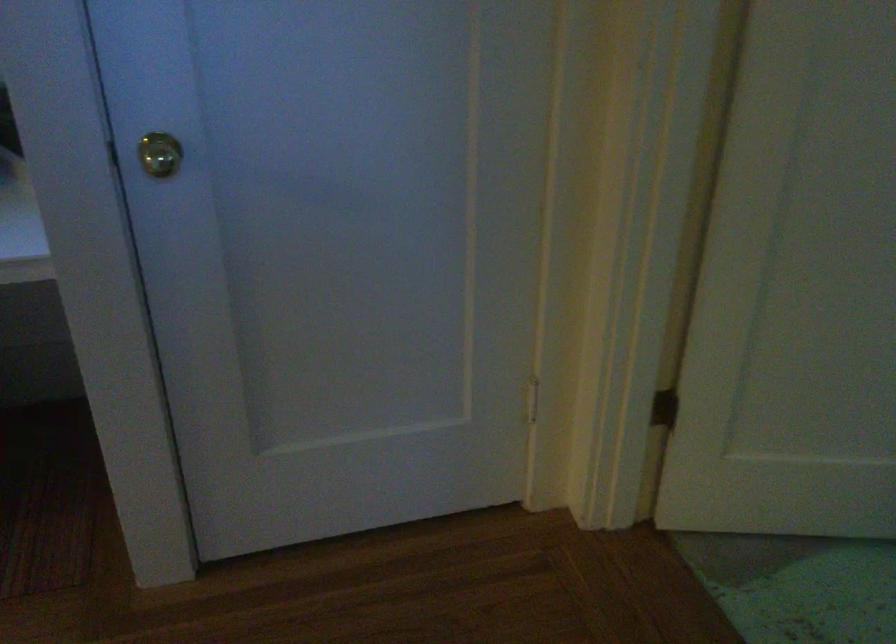
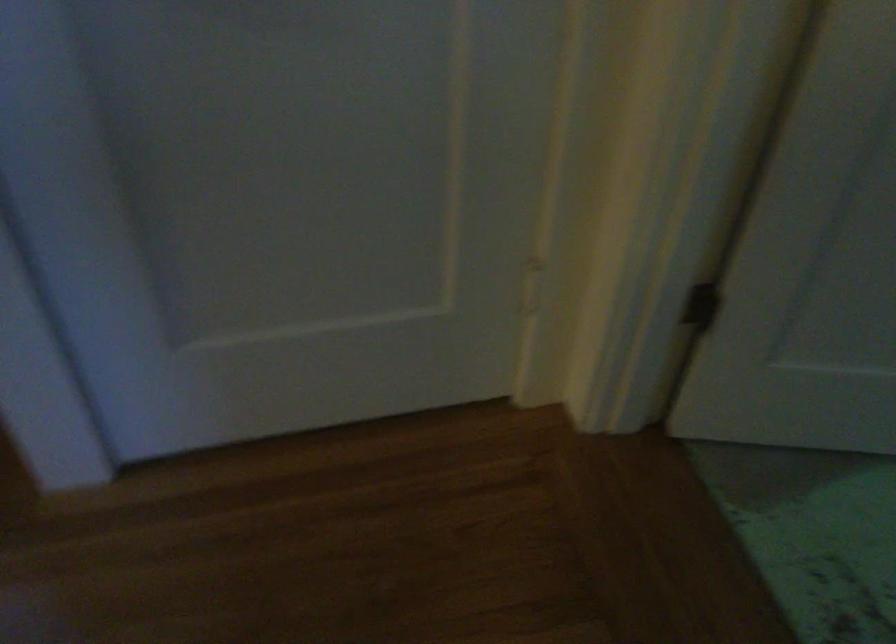
Question: What movement of the cameraman would produce the second image?

Choices:
 (A) Left
 (B) Right
 (C) Forward
 (D) Backward

Answer: (C)